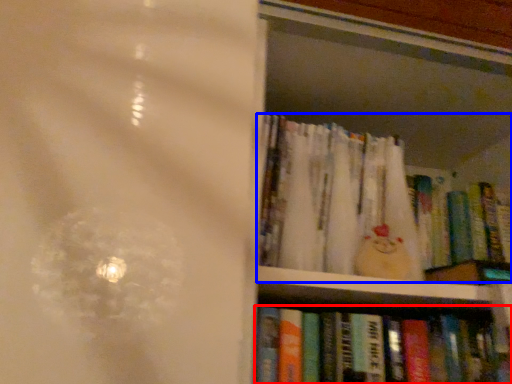
Question: Which point is closer to the camera, book (highlighted by a red box) or book (highlighted by a blue box)?

Choices:
 (A) book
 (B) book

Answer: (A)